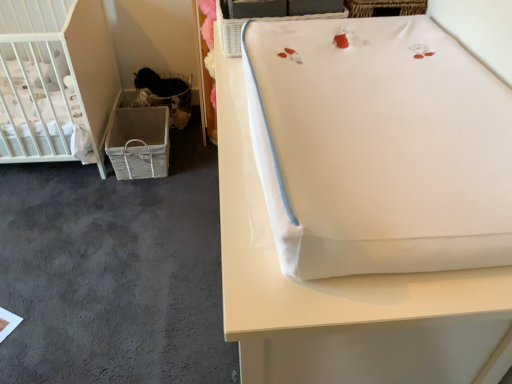
Question: Is white fabric changing pad at upper right behind white matte crib at left?

Choices:
 (A) yes
 (B) no

Answer: (B)

Question: Does white fabric changing pad at upper right have a larger size compared to white matte crib at left?

Choices:
 (A) yes
 (B) no

Answer: (A)

Question: Would you say white fabric changing pad at upper right contains white matte crib at left?

Choices:
 (A) yes
 (B) no

Answer: (B)

Question: Is white fabric changing pad at upper right not close to white matte crib at left?

Choices:
 (A) yes
 (B) no

Answer: (A)

Question: Would you say white fabric changing pad at upper right is outside white matte crib at left?

Choices:
 (A) yes
 (B) no

Answer: (A)

Question: Considering the relative sizes of white fabric changing pad at upper right and white matte crib at left in the image provided, is white fabric changing pad at upper right thinner than white matte crib at left?

Choices:
 (A) no
 (B) yes

Answer: (B)

Question: Are white matte crib at left and woven fabric basket at lower left making contact?

Choices:
 (A) no
 (B) yes

Answer: (A)

Question: Is white matte crib at left surrounding woven fabric basket at lower left?

Choices:
 (A) no
 (B) yes

Answer: (A)

Question: Is white matte crib at left located outside woven fabric basket at lower left?

Choices:
 (A) yes
 (B) no

Answer: (A)

Question: From the image's perspective, does white matte crib at left appear lower than woven fabric basket at lower left?

Choices:
 (A) no
 (B) yes

Answer: (A)

Question: Is white matte crib at left facing away from woven fabric basket at lower left?

Choices:
 (A) no
 (B) yes

Answer: (A)

Question: Considering the relative sizes of white matte crib at left and woven fabric basket at lower left in the image provided, is white matte crib at left shorter than woven fabric basket at lower left?

Choices:
 (A) no
 (B) yes

Answer: (A)

Question: From the image's perspective, is woven fabric basket at lower left located above white fabric changing pad at upper right?

Choices:
 (A) yes
 (B) no

Answer: (A)